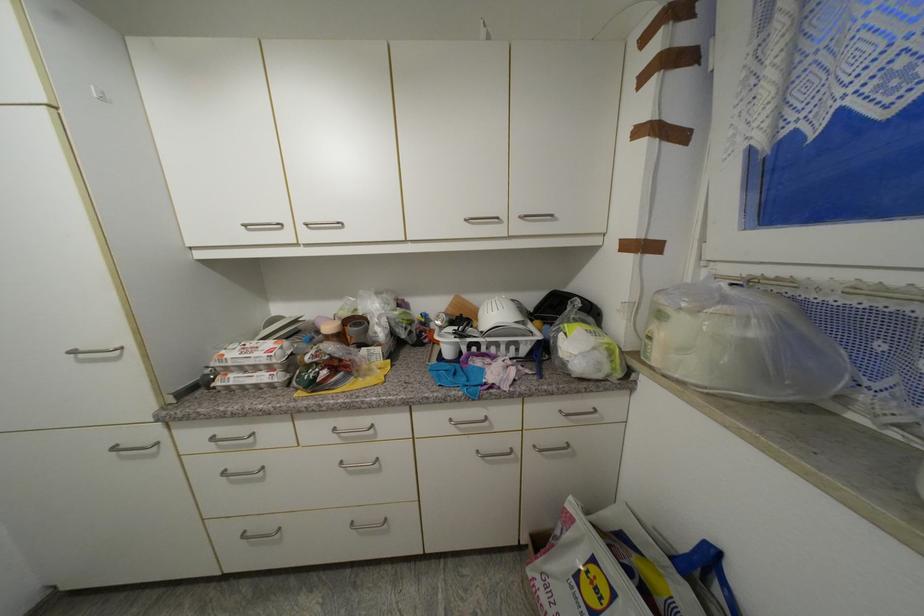
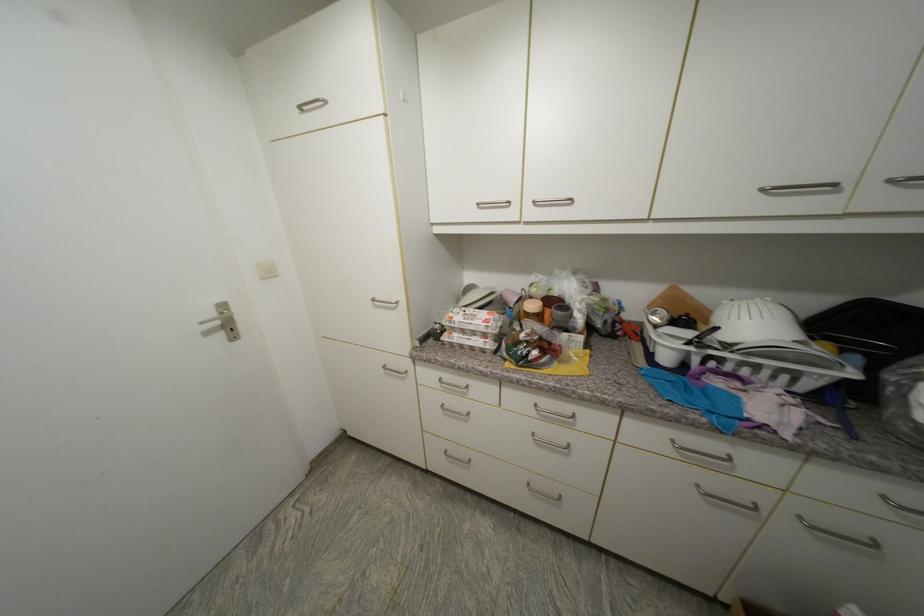
The point at (275, 369) is marked in the first image. Where is the corresponding point in the second image?

(490, 337)